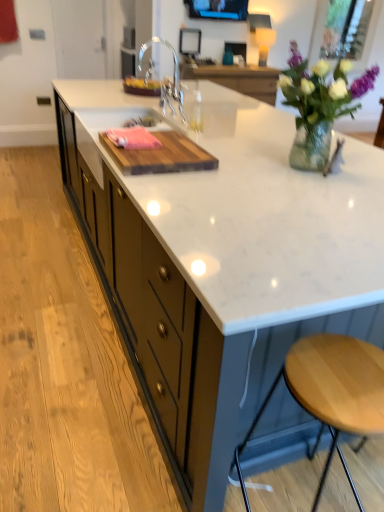
Identify the location of empty space that is ontop of light brown wood stool at lower right (from a real-world perspective). Image resolution: width=384 pixels, height=512 pixels. (335, 374).